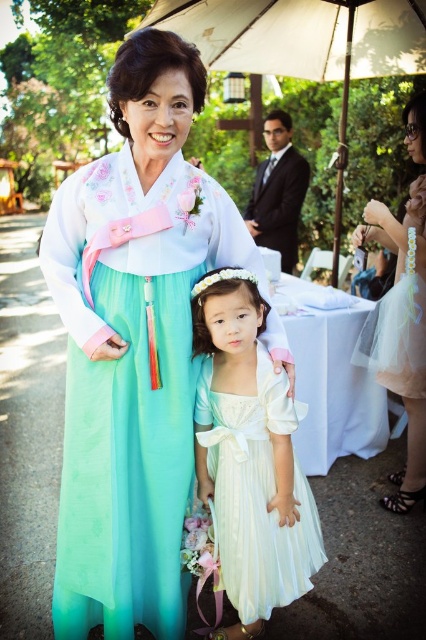
Who is shorter, white fabric umbrella at upper center or tulle dress at lower right?

Standing shorter between the two is tulle dress at lower right.

From the picture: Is white fabric umbrella at upper center further to camera compared to tulle dress at lower right?

Yes, it is.

Is point (296, 13) positioned after point (360, 340)?

Yes, point (296, 13) is behind point (360, 340).

You are a GUI agent. You are given a task and a screenshot of the screen. Output one action in this format:
    pyautogui.click(x=<x>, y=<y>)
    Task: Click on the white fabric umbrella at upper center
    
    Given the screenshot: What is the action you would take?
    pyautogui.click(x=304, y=44)

Does pastel green silk hanbok at center have a larger size compared to white satin dress at center?

Indeed, pastel green silk hanbok at center has a larger size compared to white satin dress at center.

How far apart are pastel green silk hanbok at center and white satin dress at center?

pastel green silk hanbok at center is 9.61 inches away from white satin dress at center.

Who is more distant from viewer, (170, 68) or (219, 408)?

The point (219, 408) is more distant.

Where is `pastel green silk hanbok at center`? Image resolution: width=426 pixels, height=640 pixels. pastel green silk hanbok at center is located at coordinates point(132,344).

Based on the photo, is pastel green silk hanbok at center to the right of tulle dress at lower right from the viewer's perspective?

In fact, pastel green silk hanbok at center is to the left of tulle dress at lower right.

Does pastel green silk hanbok at center have a greater height compared to tulle dress at lower right?

Indeed, pastel green silk hanbok at center has a greater height compared to tulle dress at lower right.

The width and height of the screenshot is (426, 640). I want to click on pastel green silk hanbok at center, so click(132, 344).